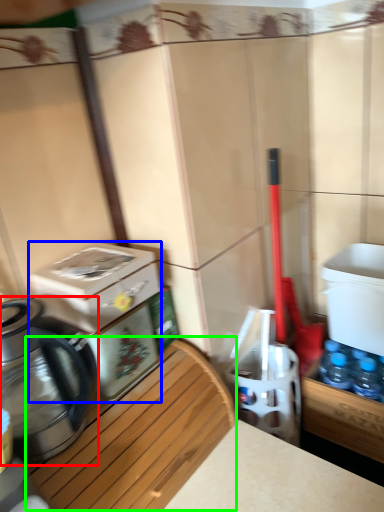
Question: Estimate the real-world distances between objects in this image. Which object is farther from kettle (highlighted by a red box), water cooler (highlighted by a blue box) or wood (highlighted by a green box)?

Choices:
 (A) water cooler
 (B) wood

Answer: (B)